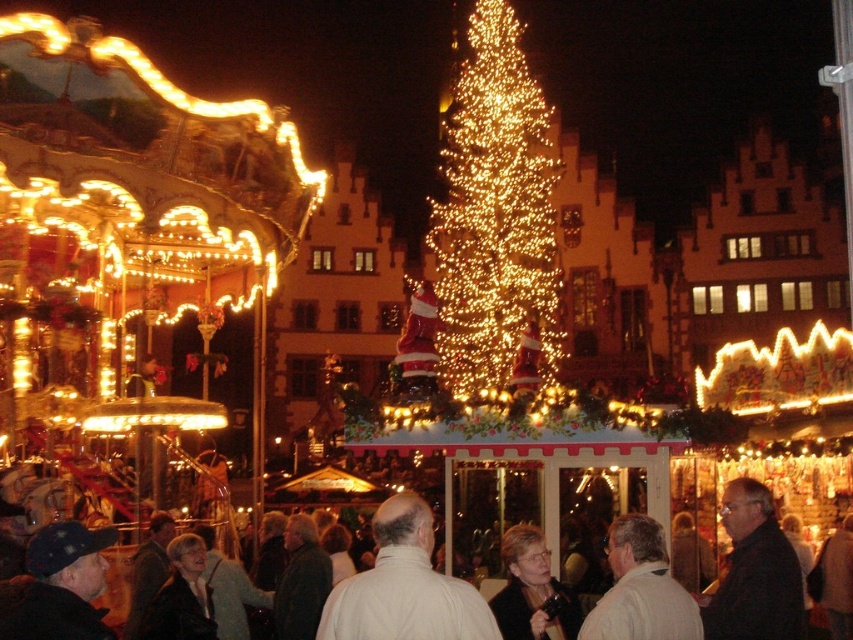
You are a photographer at the Christmas market and want to capture both the white matte jacket at center and the white matte jacket at lower center in a single shot. Which jacket should you focus on first to ensure both are in frame?

You should focus on the white matte jacket at lower center first because it is larger and closer to the camera, making it easier to frame both jackets in the shot.

You are standing at the entrance of the Christmas market and want to take a photo of the two points mentioned in the scene. Which point, point [361,602] or point [512,554], would appear larger in your camera view?

Point [361,602] appears larger in the camera view because it is closer to the camera than point [512,554].